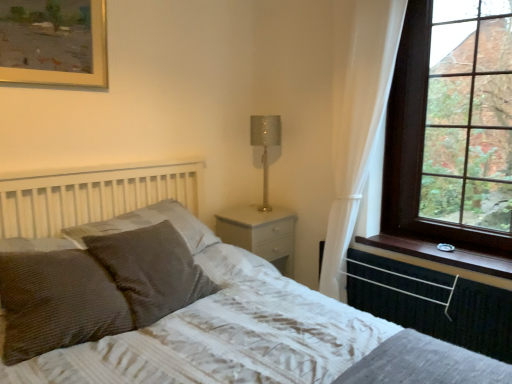
What is the approximate height of gold-framed painting at upper left?

The height of gold-framed painting at upper left is 16.54 inches.

This screenshot has height=384, width=512. What are the coordinates of `white sheer curtain at right` in the screenshot? It's located at (357, 117).

Describe the element at coordinates (244, 339) in the screenshot. The width and height of the screenshot is (512, 384). I see `textured gray bed at center` at that location.

Locate an element on the screen. The height and width of the screenshot is (384, 512). brown textured pillow at center, which is counted as the second pillow, starting from the front is located at coordinates (151, 270).

Is point (178, 223) more distant than point (189, 358)?

That is True.

Looking at this image, do you think textured brown pillow at center-left, which ranks as the first pillow in back-to-front order, is within textured gray bed at center, or outside of it?

textured brown pillow at center-left, which ranks as the first pillow in back-to-front order, lies within the bounds of textured gray bed at center.

Looking at this image, considering the positions of objects textured brown pillow at center-left, the 3th pillow when ordered from front to back, and textured gray bed at center in the image provided, who is more to the right, textured brown pillow at center-left, the 3th pillow when ordered from front to back, or textured gray bed at center?

textured gray bed at center is more to the right.

Which of these two, textured brown pillow at center-left, the 3th pillow when ordered from front to back, or textured gray bed at center, is smaller?

textured brown pillow at center-left, the 3th pillow when ordered from front to back.

Would you say white sheer curtain at right is inside or outside textured gray bed at center?

white sheer curtain at right cannot be found inside textured gray bed at center.

Does point (362, 177) appear closer or farther from the camera than point (40, 369)?

Clearly, point (362, 177) is more distant from the camera than point (40, 369).

Can you confirm if white sheer curtain at right is smaller than textured gray bed at center?

Yes.

From a real-world perspective, is white sheer curtain at right positioned under textured gray bed at center based on gravity?

Incorrect, from a real-world perspective, white sheer curtain at right is higher than textured gray bed at center.

How different are the orientations of textured gray bed at center and brown textured pillow at lower left, the third pillow when ordered from back to front, in degrees?

There is a 8.35-degree angle between the facing directions of textured gray bed at center and brown textured pillow at lower left, the third pillow when ordered from back to front.

Which object is further away from the camera, textured gray bed at center or brown textured pillow at lower left, the third pillow when ordered from back to front?

brown textured pillow at lower left, the third pillow when ordered from back to front, is further from the camera.

Could you tell me if textured gray bed at center is facing brown textured pillow at lower left, which ranks as the 1th pillow in front-to-back order?

No.

Which is more to the left, textured gray bed at center or brown textured pillow at lower left, the third pillow when ordered from back to front?

brown textured pillow at lower left, the third pillow when ordered from back to front, is more to the left.

This screenshot has height=384, width=512. Find the location of `nightstand on the left of metallic silver table lamp at upper right`. nightstand on the left of metallic silver table lamp at upper right is located at coordinates (261, 233).

From the image's perspective, is white glossy nightstand at center under metallic silver table lamp at upper right?

Correct, white glossy nightstand at center appears lower than metallic silver table lamp at upper right in the image.

Is white glossy nightstand at center oriented towards metallic silver table lamp at upper right?

No, white glossy nightstand at center is not facing towards metallic silver table lamp at upper right.

Is white glossy nightstand at center not close to metallic silver table lamp at upper right?

No, white glossy nightstand at center is not far from metallic silver table lamp at upper right.

Is brown wood window sill at right next to gold-framed painting at upper left?

They are not placed beside each other.

Looking at their sizes, would you say brown wood window sill at right is wider or thinner than gold-framed painting at upper left?

Clearly, brown wood window sill at right has more width compared to gold-framed painting at upper left.

Is brown wood window sill at right facing towards gold-framed painting at upper left?

No, brown wood window sill at right does not turn towards gold-framed painting at upper left.

How different are the orientations of brown wood window sill at right and gold-framed painting at upper left in degrees?

88.6 degrees separate the facing orientations of brown wood window sill at right and gold-framed painting at upper left.

Is textured brown pillow at center-left, which ranks as the first pillow in back-to-front order, in front of black rubber radiator at lower right?

That is True.

Between textured brown pillow at center-left, the 3th pillow when ordered from front to back, and black rubber radiator at lower right, which one has smaller width?

black rubber radiator at lower right is thinner.

Is black rubber radiator at lower right at the back of textured brown pillow at center-left, which ranks as the first pillow in back-to-front order?

textured brown pillow at center-left, which ranks as the first pillow in back-to-front order, is not turned away from black rubber radiator at lower right.

Is the position of textured gray bed at center more distant than that of black rubber radiator at lower right?

No, the depth of textured gray bed at center is less than that of black rubber radiator at lower right.

Is textured gray bed at center aimed at black rubber radiator at lower right?

No, textured gray bed at center is not aimed at black rubber radiator at lower right.

Are textured gray bed at center and black rubber radiator at lower right making contact?

They are not placed beside each other.

The width and height of the screenshot is (512, 384). Identify the location of bed below the black rubber radiator at lower right (from the image's perspective). (244, 339).

Where is `pillow that is the 3rd one when counting backward from the textured gray bed at center`? Image resolution: width=512 pixels, height=384 pixels. pillow that is the 3rd one when counting backward from the textured gray bed at center is located at coordinates (149, 225).

Image resolution: width=512 pixels, height=384 pixels. I want to click on curtain that is above the textured gray bed at center (from the image's perspective), so click(357, 117).

Considering their positions, is textured brown pillow at center-left, the 3th pillow when ordered from front to back, positioned further to brown wooden window at upper right than brown textured pillow at lower left, the third pillow when ordered from back to front?

brown textured pillow at lower left, the third pillow when ordered from back to front, is positioned further to the anchor brown wooden window at upper right.

Which object lies further to the anchor point metallic silver table lamp at upper right, black rubber radiator at lower right or gold-framed painting at upper left?

gold-framed painting at upper left is positioned further to the anchor metallic silver table lamp at upper right.

When comparing their distances from brown textured pillow at lower left, the third pillow when ordered from back to front, does metallic silver table lamp at upper right or textured gray bed at center seem further?

metallic silver table lamp at upper right is further to brown textured pillow at lower left, the third pillow when ordered from back to front.

Estimate the real-world distances between objects in this image. Which object is further from brown wood window sill at right, gold-framed painting at upper left or brown textured pillow at lower left, the third pillow when ordered from back to front?

The object further to brown wood window sill at right is gold-framed painting at upper left.

From the picture: When comparing their distances from black rubber radiator at lower right, does white glossy nightstand at center or metallic silver table lamp at upper right seem closer?

Based on the image, white glossy nightstand at center appears to be nearer to black rubber radiator at lower right.

Estimate the real-world distances between objects in this image. Which object is closer to textured brown pillow at center-left, the 3th pillow when ordered from front to back, brown textured pillow at lower left, the third pillow when ordered from back to front, or white glossy nightstand at center?

The object closer to textured brown pillow at center-left, the 3th pillow when ordered from front to back, is brown textured pillow at lower left, the third pillow when ordered from back to front.

Which object lies further to the anchor point textured brown pillow at center-left, which ranks as the first pillow in back-to-front order, brown textured pillow at lower left, the third pillow when ordered from back to front, or textured gray bed at center?

textured gray bed at center is positioned further to the anchor textured brown pillow at center-left, which ranks as the first pillow in back-to-front order.

Estimate the real-world distances between objects in this image. Which object is closer to gold-framed painting at upper left, brown wood window sill at right or black rubber radiator at lower right?

Among the two, brown wood window sill at right is located nearer to gold-framed painting at upper left.

The width and height of the screenshot is (512, 384). What are the coordinates of `nightstand located between brown textured pillow at lower left, which ranks as the 1th pillow in front-to-back order, and brown wood window sill at right in the left-right direction` in the screenshot? It's located at (261, 233).

You are a GUI agent. You are given a task and a screenshot of the screen. Output one action in this format:
    pyautogui.click(x=<x>, y=<y>)
    Task: Click on the table lamp between gold-framed painting at upper left and black rubber radiator at lower right from left to right
    
    Given the screenshot: What is the action you would take?
    pyautogui.click(x=265, y=145)

Find the location of a particular element. This screenshot has width=512, height=384. radiator positioned between textured gray bed at center and brown wood window sill at right from near to far is located at coordinates (445, 314).

Locate an element on the screen. This screenshot has width=512, height=384. radiator located between brown textured pillow at lower left, which ranks as the 1th pillow in front-to-back order, and brown wood window sill at right in the left-right direction is located at coordinates click(x=445, y=314).